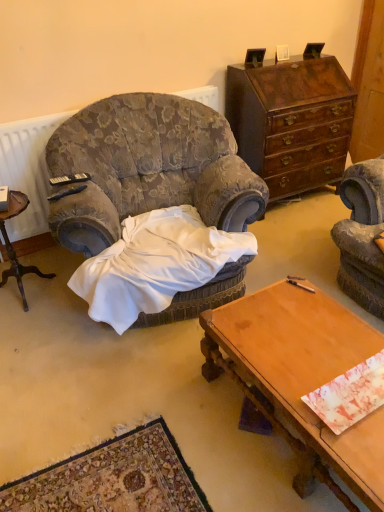
Image resolution: width=384 pixels, height=512 pixels. In order to click on vacant area that is in front of velvet-patterned armchair at center in this screenshot , I will do `click(123, 412)`.